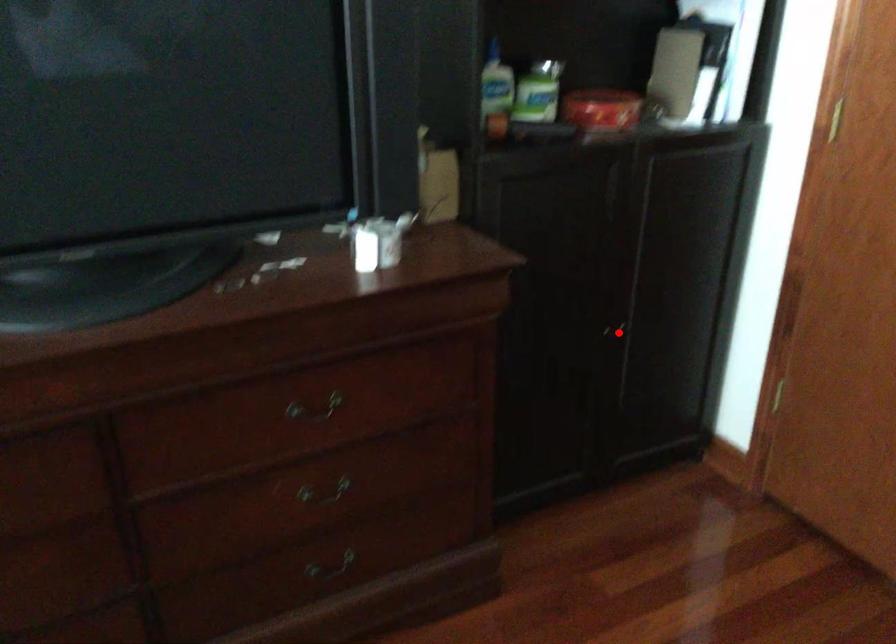
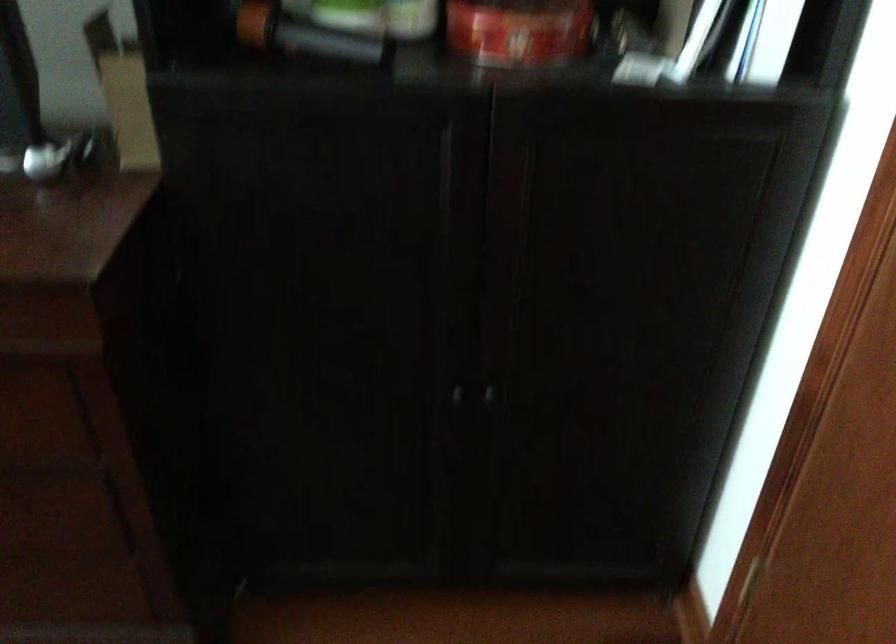
The point at the highlighted location is marked in the first image. Where is the corresponding point in the second image?

(487, 395)